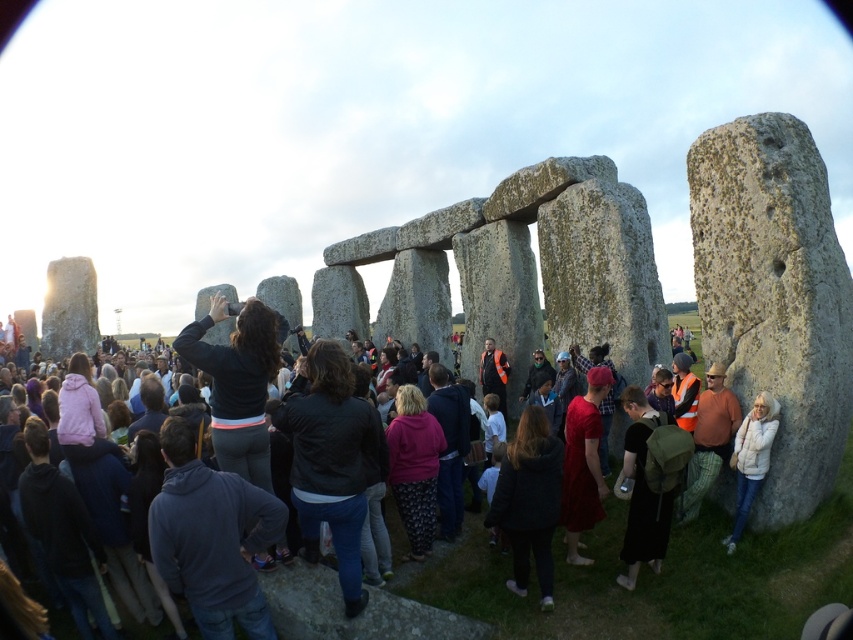
Can you confirm if black fuzzy jacket at center is positioned below black matte backpack at lower right?

Indeed, black fuzzy jacket at center is positioned under black matte backpack at lower right.

Can you confirm if black fuzzy jacket at center is taller than black matte backpack at lower right?

Incorrect, black fuzzy jacket at center's height is not larger of black matte backpack at lower right's.

What do you see at coordinates (529, 500) in the screenshot? This screenshot has height=640, width=853. I see `black fuzzy jacket at center` at bounding box center [529, 500].

In order to click on black fuzzy jacket at center in this screenshot , I will do `click(529, 500)`.

Is point (779, 282) positioned behind point (444, 605)?

No, (779, 282) is closer to viewer.

Does granite rock at center come behind dark gray stone at center?

Yes, granite rock at center is further from the viewer.

Where is `granite rock at center`? Image resolution: width=853 pixels, height=640 pixels. granite rock at center is located at coordinates pos(775,296).

Find the location of a particular element. The height and width of the screenshot is (640, 853). granite rock at center is located at coordinates (775, 296).

Who is taller, granite rock at center or black matte backpack at lower right?

granite rock at center is taller.

Who is more forward, (814, 372) or (625, 476)?

Point (814, 372) is more forward.

Between point (769, 340) and point (625, 465), which one is positioned behind?

The point (625, 465) is more distant.

At what (x,y) coordinates should I click in order to perform the action: click on granite rock at center. Please return your answer as a coordinate pair (x, y). Looking at the image, I should click on (775, 296).